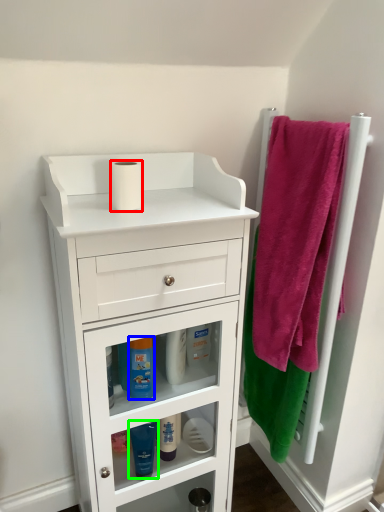
Question: Considering the real-world distances, which object is farthest from toilet paper (highlighted by a red box)? mouthwash (highlighted by a blue box) or mouthwash (highlighted by a green box)?

Choices:
 (A) mouthwash
 (B) mouthwash

Answer: (B)